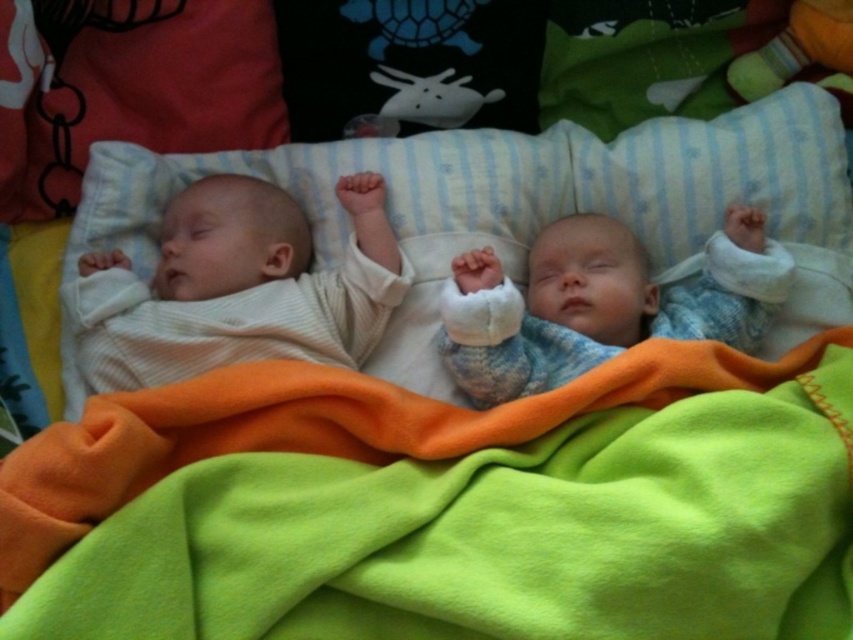
Who is higher up, white ribbed fabric baby at left or knitted blue sweater at center?

white ribbed fabric baby at left is higher up.

Does white ribbed fabric baby at left have a lesser width compared to knitted blue sweater at center?

Indeed, white ribbed fabric baby at left has a lesser width compared to knitted blue sweater at center.

Identify the location of white ribbed fabric baby at left. This screenshot has width=853, height=640. (236, 288).

Find the location of a particular element. The image size is (853, 640). white ribbed fabric baby at left is located at coordinates (236, 288).

Between point (517, 579) and point (445, 330), which one is positioned behind?

The point (445, 330) is more distant.

Between green fleece blanket at lower center and knitted blue sweater at center, which one appears on the left side from the viewer's perspective?

Positioned to the left is green fleece blanket at lower center.

What do you see at coordinates (439, 502) in the screenshot? The width and height of the screenshot is (853, 640). I see `green fleece blanket at lower center` at bounding box center [439, 502].

Where is `green fleece blanket at lower center`? The width and height of the screenshot is (853, 640). green fleece blanket at lower center is located at coordinates (439, 502).

Who is lower down, green fleece blanket at lower center or white ribbed fabric baby at left?

Positioned lower is green fleece blanket at lower center.

Can you confirm if green fleece blanket at lower center is taller than white ribbed fabric baby at left?

Incorrect, green fleece blanket at lower center's height is not larger of white ribbed fabric baby at left's.

Who is more forward, (x=807, y=384) or (x=364, y=326)?

Point (x=807, y=384)

Where is `green fleece blanket at lower center`? The width and height of the screenshot is (853, 640). green fleece blanket at lower center is located at coordinates (439, 502).